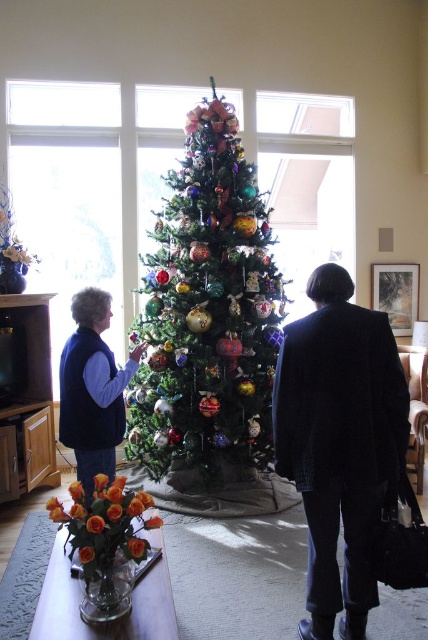
Question: Is green textured christmas tree at center smaller than velvet blue vest at left?

Choices:
 (A) no
 (B) yes

Answer: (A)

Question: Does green textured christmas tree at center appear on the right side of dark wool coat at center?

Choices:
 (A) no
 (B) yes

Answer: (A)

Question: Can you confirm if green textured christmas tree at center is wider than velvet blue vest at left?

Choices:
 (A) no
 (B) yes

Answer: (B)

Question: Which point is closer to the camera taking this photo?

Choices:
 (A) (195, 426)
 (B) (357, 360)
 (C) (119, 412)

Answer: (B)

Question: Based on their relative distances, which object is farther from the velvet blue vest at left?

Choices:
 (A) green textured christmas tree at center
 (B) dark wool coat at center

Answer: (B)

Question: Which point appears closest to the camera in this image?

Choices:
 (A) (162, 467)
 (B) (133, 369)
 (C) (326, 410)

Answer: (C)